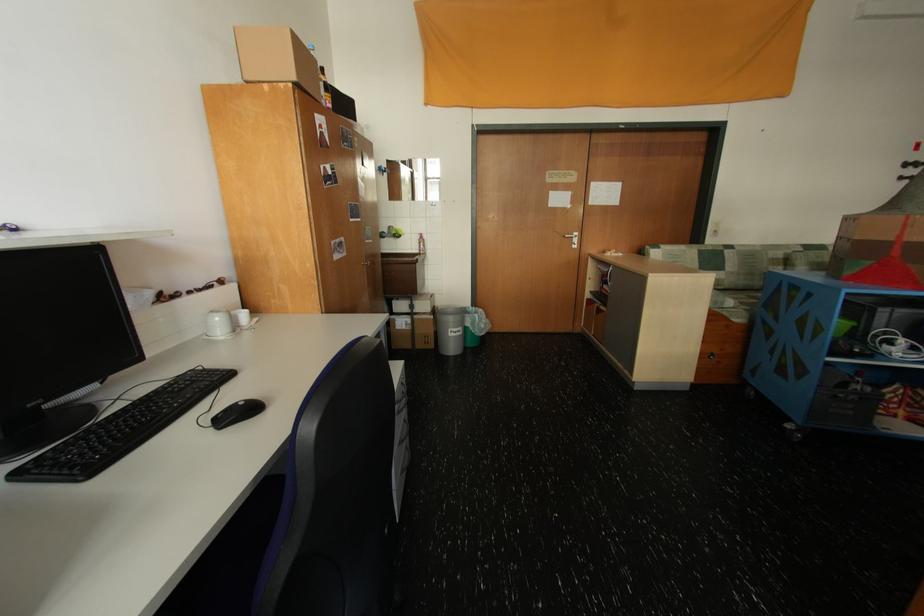
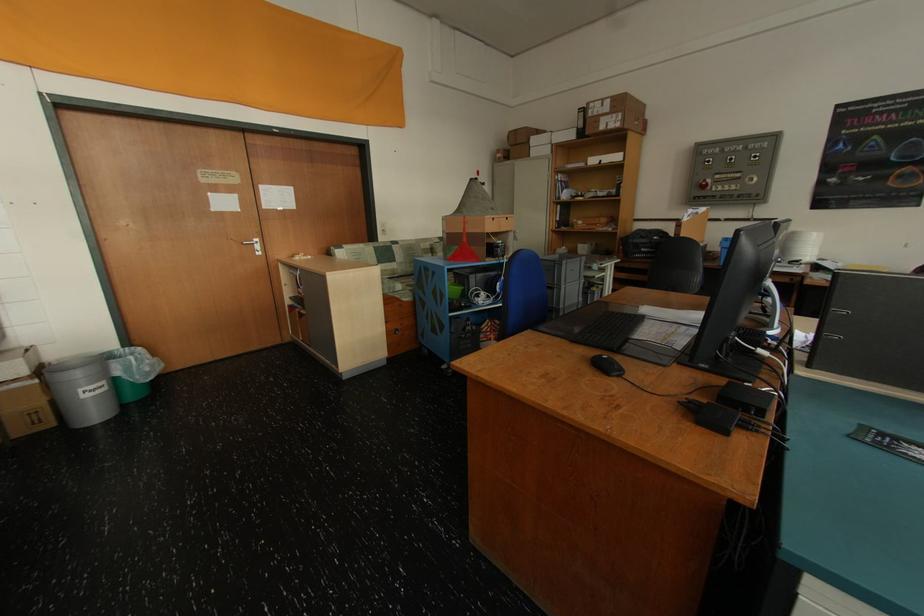
Find the pixel in the second image that matches point (436, 344) in the first image.

(50, 422)